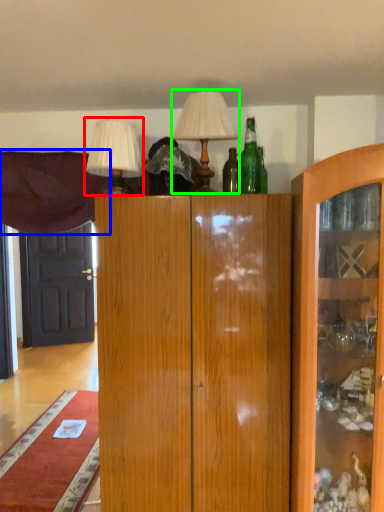
Question: Based on their relative distances, which object is farther from table lamp (highlighted by a red box)? Choose from curtain (highlighted by a blue box) and table lamp (highlighted by a green box).

Choices:
 (A) curtain
 (B) table lamp

Answer: (A)